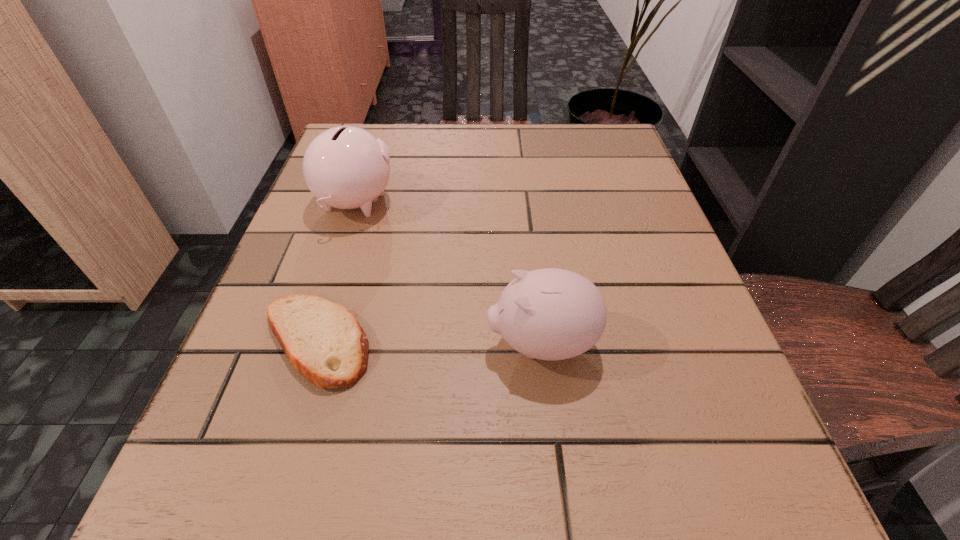
You are a GUI agent. You are given a task and a screenshot of the screen. Output one action in this format:
    pyautogui.click(x=<x>, y=<y>)
    Task: Click on the object that is at the far edge
    The width and height of the screenshot is (960, 540).
    Given the screenshot: What is the action you would take?
    pyautogui.click(x=347, y=167)

In order to click on piggy bank located at the left edge in this screenshot , I will do `click(347, 167)`.

Locate an element on the screen. This screenshot has height=540, width=960. pita bread located in the left edge section of the desktop is located at coordinates (323, 341).

Identify the location of object present at the far left corner. This screenshot has width=960, height=540. (347, 167).

Find the location of a particular element. vacant space at the far edge of the desktop is located at coordinates (492, 150).

The height and width of the screenshot is (540, 960). In the image, there is a desktop. Find the location of `vacant space at the near edge`. vacant space at the near edge is located at coordinates click(523, 468).

Find the location of `vacant space at the left edge of the desktop`. vacant space at the left edge of the desktop is located at coordinates (232, 438).

This screenshot has width=960, height=540. In the image, there is a desktop. In order to click on vacant space at the right edge in this screenshot , I will do `click(609, 182)`.

Identify the location of vacant region at the far left corner of the desktop. Image resolution: width=960 pixels, height=540 pixels. (397, 136).

In the image, there is a desktop. In order to click on free space at the far right corner in this screenshot , I will do `click(614, 163)`.